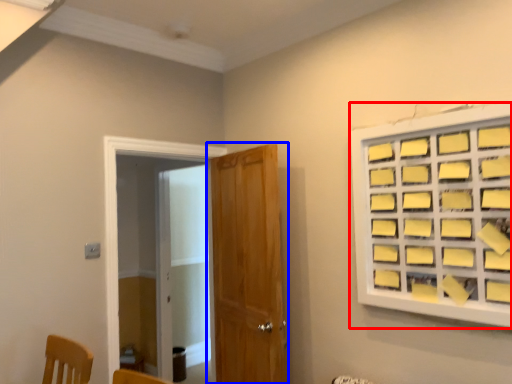
Question: Which object is further to the camera taking this photo, window (highlighted by a red box) or door (highlighted by a blue box)?

Choices:
 (A) window
 (B) door

Answer: (B)